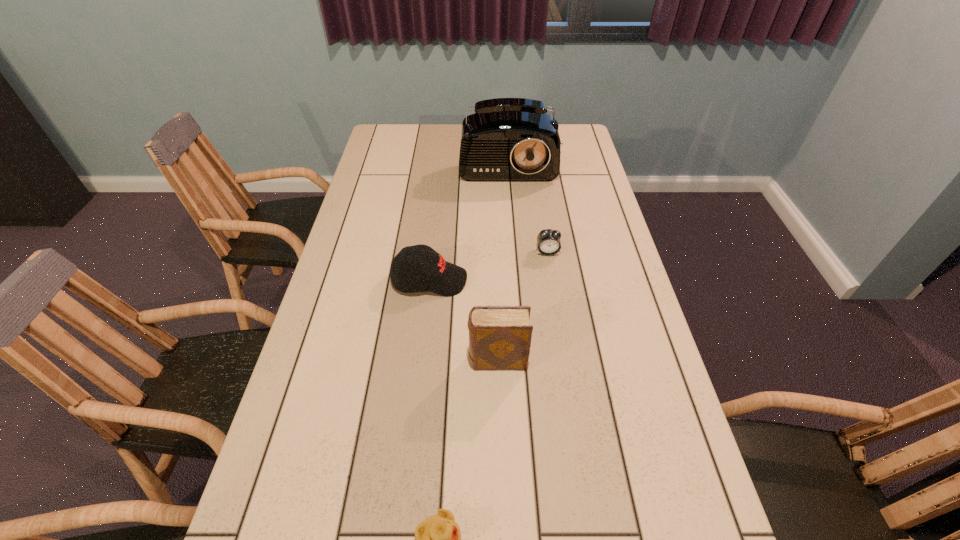
This screenshot has height=540, width=960. Find the location of `free space that satisfies the following two spatial constraints: 1. on the front-facing side of the radio receiver; 2. on the spine side of the fourth shortest object`. free space that satisfies the following two spatial constraints: 1. on the front-facing side of the radio receiver; 2. on the spine side of the fourth shortest object is located at coordinates (524, 361).